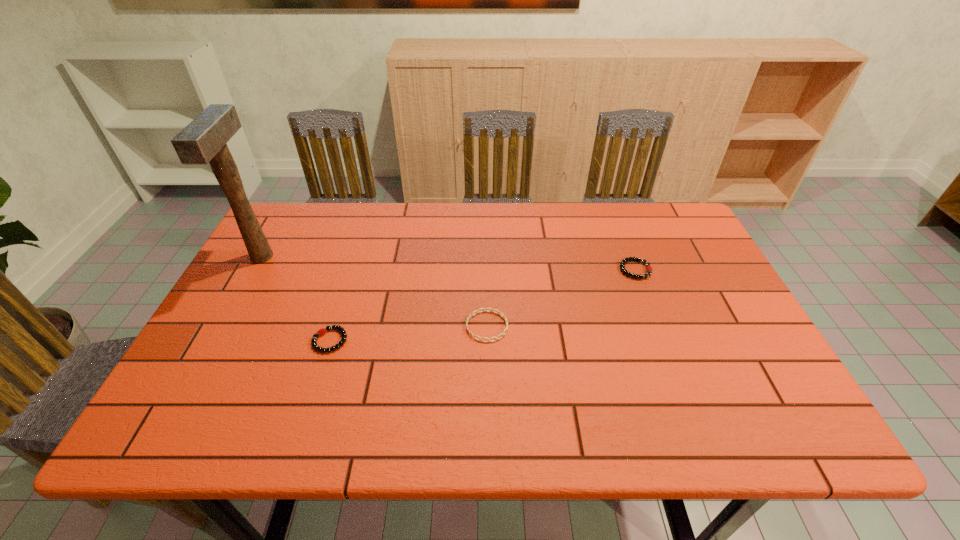
At what (x,y) coordinates should I click in order to perform the action: click on the leftmost object. Please return your answer as a coordinate pair (x, y). Looking at the image, I should click on (203, 140).

At what (x,y) coordinates should I click in order to perform the action: click on mallet. Please return your answer as a coordinate pair (x, y). The image size is (960, 540). Looking at the image, I should click on (203, 140).

Locate an element on the screen. This screenshot has width=960, height=540. the farthest bracelet is located at coordinates (622, 264).

Find the location of a particular element. The height and width of the screenshot is (540, 960). the rightmost bracelet is located at coordinates (622, 264).

Image resolution: width=960 pixels, height=540 pixels. I want to click on the second bracelet from right to left, so click(477, 311).

Locate an element on the screen. This screenshot has width=960, height=540. the leftmost bracelet is located at coordinates pyautogui.click(x=322, y=331).

This screenshot has height=540, width=960. In order to click on vacant space situated on the right of the tallest object in this screenshot , I will do `click(327, 257)`.

Identify the location of vacant space located 0.320m on the left of the rightmost object. (505, 270).

Find the location of a particular element. The image size is (960, 540). vacant space situated on the surface of the third object from left to right showing star-shaped elements is located at coordinates (401, 326).

Where is `vacant space located on the surface of the third object from left to right showing star-shaped elements`? vacant space located on the surface of the third object from left to right showing star-shaped elements is located at coordinates (365, 326).